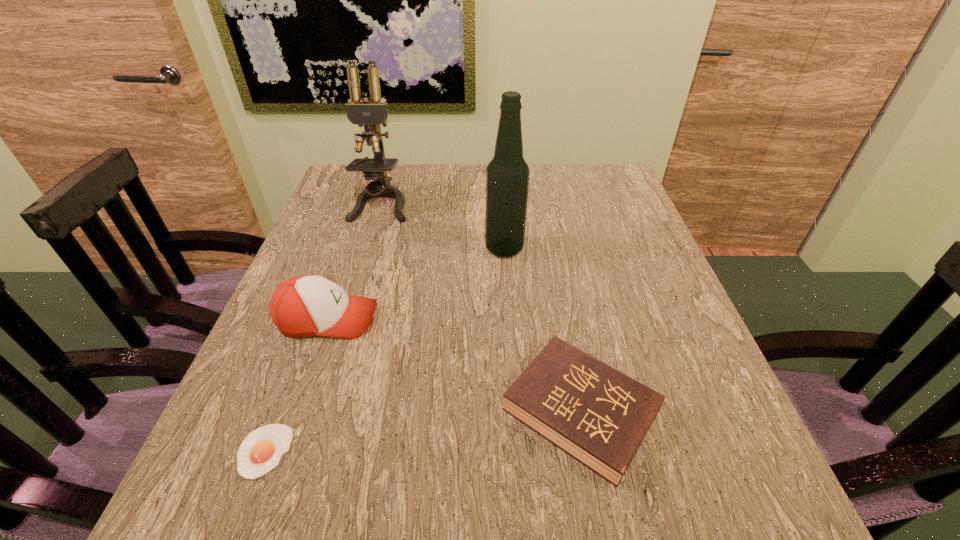
The height and width of the screenshot is (540, 960). Find the location of `free space that satisfies the following two spatial constraints: 1. at the eyepieces of the second shortest object; 2. on the right side of the farthest object`. free space that satisfies the following two spatial constraints: 1. at the eyepieces of the second shortest object; 2. on the right side of the farthest object is located at coordinates (318, 411).

I want to click on vacant space that satisfies the following two spatial constraints: 1. on the back side of the fourth tallest object; 2. on the front-facing side of the third tallest object, so click(x=563, y=319).

Where is `free space in the image that satisfies the following two spatial constraints: 1. at the eyepieces of the alcohol; 2. on the right side of the farthest object`? The image size is (960, 540). free space in the image that satisfies the following two spatial constraints: 1. at the eyepieces of the alcohol; 2. on the right side of the farthest object is located at coordinates (368, 248).

You are a GUI agent. You are given a task and a screenshot of the screen. Output one action in this format:
    pyautogui.click(x=<x>, y=<y>)
    Task: Click on the free space that satisfies the following two spatial constraints: 1. at the eyepieces of the microscope; 2. on the front-facing side of the third tallest object
    The height and width of the screenshot is (540, 960).
    Given the screenshot: What is the action you would take?
    pyautogui.click(x=347, y=319)

Image resolution: width=960 pixels, height=540 pixels. I want to click on vacant region that satisfies the following two spatial constraints: 1. at the eyepieces of the second farthest object; 2. on the right side of the farthest object, so click(368, 248).